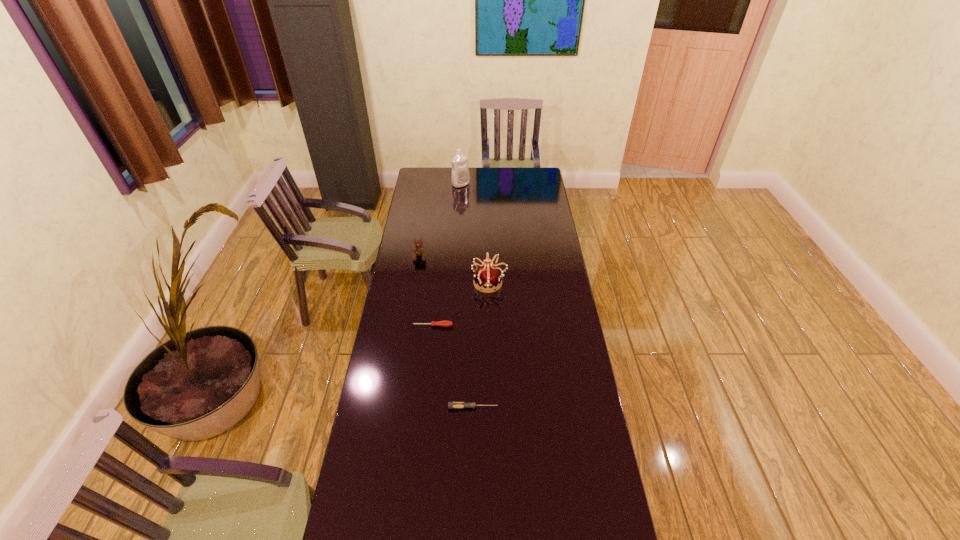
Identify the location of the farthest object. (460, 177).

Find the location of `detergent`. detergent is located at coordinates (460, 177).

You are a GUI agent. You are given a task and a screenshot of the screen. Output one action in this format:
    pyautogui.click(x=<x>, y=<y>)
    Task: Click on the tiara
    The image size is (960, 540).
    Given the screenshot: What is the action you would take?
    pyautogui.click(x=488, y=276)

Locate an element on the screen. The height and width of the screenshot is (540, 960). the third nearest object is located at coordinates (488, 276).

Find the location of a particular element. Image resolution: width=960 pixels, height=540 pixels. teddy bear is located at coordinates (418, 249).

The width and height of the screenshot is (960, 540). In order to click on the second farthest object in this screenshot , I will do `click(418, 249)`.

At what (x,y) coordinates should I click in order to perform the action: click on the fourth farthest object. Please return your answer as a coordinate pair (x, y). The width and height of the screenshot is (960, 540). Looking at the image, I should click on (440, 323).

The height and width of the screenshot is (540, 960). I want to click on the left screwdriver, so click(440, 323).

Where is `the nearest object`? The height and width of the screenshot is (540, 960). the nearest object is located at coordinates (451, 405).

The height and width of the screenshot is (540, 960). Find the location of `the right screwdriver`. the right screwdriver is located at coordinates [451, 405].